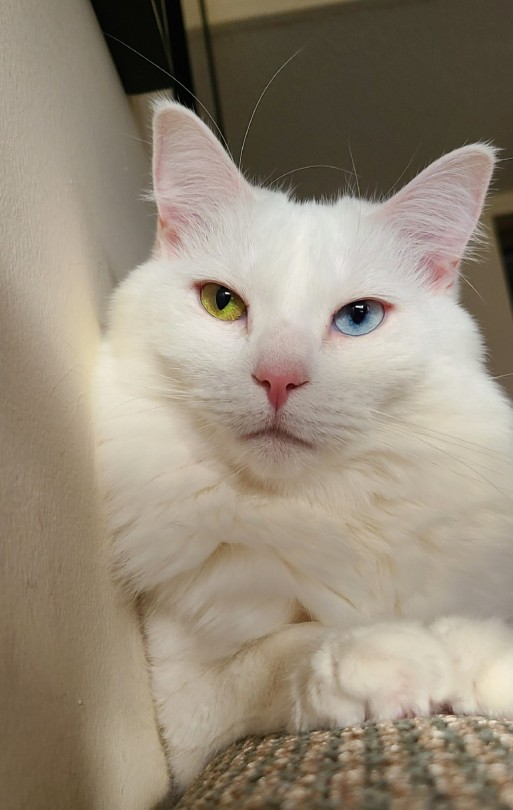
The width and height of the screenshot is (513, 810). Identify the location of fabric. (324, 770).